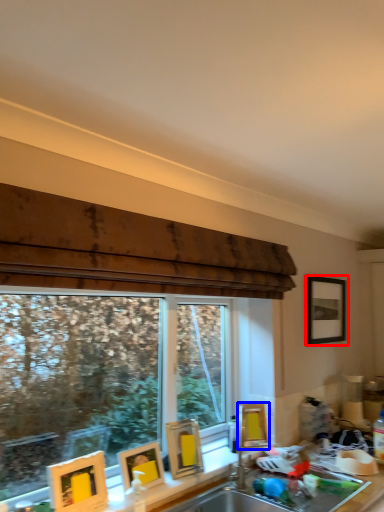
Question: Among these objects, which one is nearest to the camera, picture frame (highlighted by a red box) or picture frame (highlighted by a blue box)?

Choices:
 (A) picture frame
 (B) picture frame

Answer: (B)